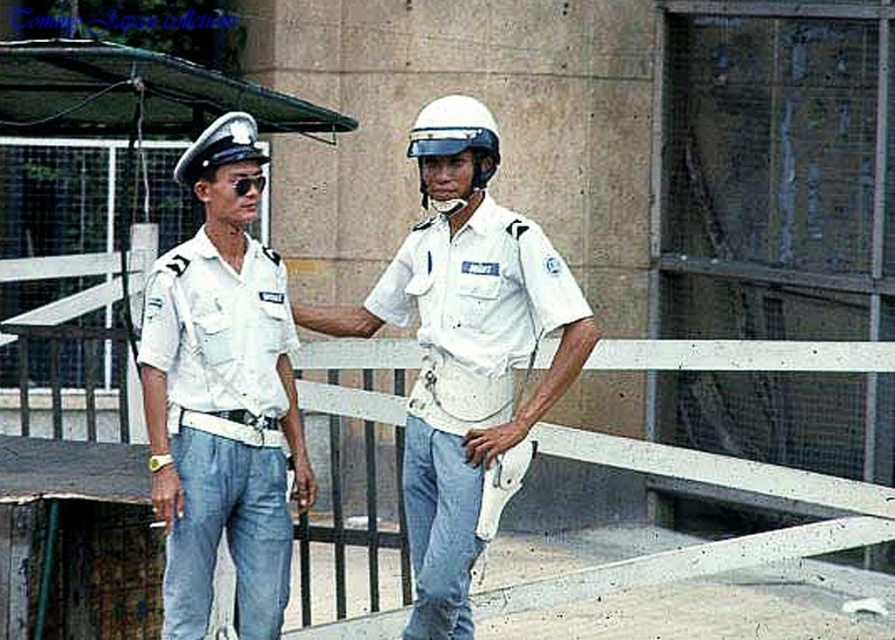
Who is higher up, white cotton shirt at left or white matte helmet at upper left?

white matte helmet at upper left is above.

Which is in front, point (254, 440) or point (203, 132)?

Point (254, 440) is in front.

Which is behind, point (276, 509) or point (231, 152)?

Positioned behind is point (276, 509).

I want to click on white cotton shirt at left, so click(x=222, y=428).

Measure the distance from white cotton shirt at left to white matte helmet at center.

They are 4.53 feet apart.

You are a GUI agent. You are given a task and a screenshot of the screen. Output one action in this format:
    pyautogui.click(x=<x>, y=<y>)
    Task: Click on the white cotton shirt at left
    The height and width of the screenshot is (640, 895).
    Given the screenshot: What is the action you would take?
    pyautogui.click(x=222, y=428)

Find the location of a particular element. This screenshot has width=895, height=640. white cotton shirt at left is located at coordinates (222, 428).

Is white matte uniform at center positioned before white cotton shirt at left?

No.

Is white matte uniform at center smaller than white cotton shirt at left?

No.

What do you see at coordinates (471, 380) in the screenshot? I see `white matte uniform at center` at bounding box center [471, 380].

Image resolution: width=895 pixels, height=640 pixels. I want to click on white matte uniform at center, so click(471, 380).